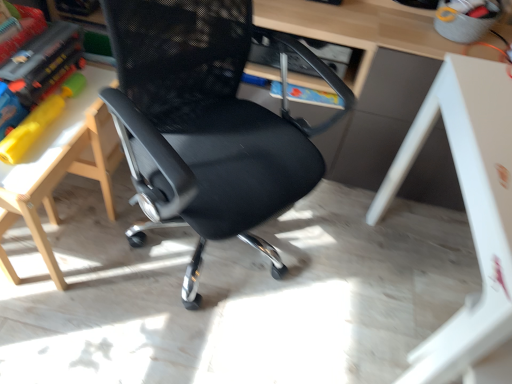
Question: From a real-world perspective, relative to black mesh chair at center, is white glossy table at lower right, arranged as the first table when viewed from the right, vertically above or below?

Choices:
 (A) below
 (B) above

Answer: (A)

Question: From the image's perspective, relative to black mesh chair at center, is white glossy table at lower right, which is counted as the 2th table, starting from the left, above or below?

Choices:
 (A) below
 (B) above

Answer: (A)

Question: Estimate the real-world distances between objects in this image. Which object is farther from the black mesh chair at center?

Choices:
 (A) matte plastic book at left
 (B) white glossy table at lower right, arranged as the first table when viewed from the right
 (C) white wood table at left, arranged as the 1th table when viewed from the left

Answer: (B)

Question: Which of these objects is positioned farthest from the white glossy table at lower right, arranged as the first table when viewed from the right?

Choices:
 (A) matte plastic book at left
 (B) black mesh chair at center
 (C) white wood table at left, arranged as the 1th table when viewed from the left

Answer: (A)